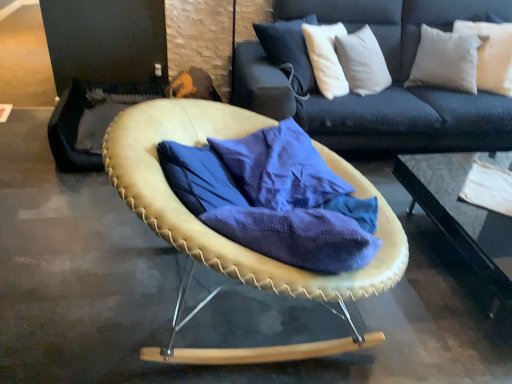
Question: Is white soft pillow at upper right completely or partially outside of leather-like tan chair at center?

Choices:
 (A) no
 (B) yes

Answer: (B)

Question: From the image's perspective, is white soft pillow at upper right located beneath leather-like tan chair at center?

Choices:
 (A) yes
 (B) no

Answer: (B)

Question: Are white soft pillow at upper right and leather-like tan chair at center far apart?

Choices:
 (A) yes
 (B) no

Answer: (A)

Question: Can you see white soft pillow at upper right touching leather-like tan chair at center?

Choices:
 (A) no
 (B) yes

Answer: (A)

Question: Is white soft pillow at upper right aimed at leather-like tan chair at center?

Choices:
 (A) no
 (B) yes

Answer: (A)

Question: Relative to white soft pillow at upper right, is leather-like tan chair at center in front or behind?

Choices:
 (A) behind
 (B) front

Answer: (B)

Question: Is leather-like tan chair at center wider or thinner than white soft pillow at upper right?

Choices:
 (A) wide
 (B) thin

Answer: (A)

Question: Looking at the image, does leather-like tan chair at center seem bigger or smaller compared to white soft pillow at upper right?

Choices:
 (A) small
 (B) big

Answer: (B)

Question: Considering the positions of point (353, 279) and point (505, 79), is point (353, 279) closer or farther from the camera than point (505, 79)?

Choices:
 (A) closer
 (B) farther

Answer: (A)

Question: Does point (437, 170) appear closer or farther from the camera than point (489, 26)?

Choices:
 (A) farther
 (B) closer

Answer: (A)

Question: Which is correct: transparent glass table at center is inside white soft pillow at upper right, or outside of it?

Choices:
 (A) outside
 (B) inside

Answer: (A)

Question: From a real-world perspective, is transparent glass table at center positioned above or below white soft pillow at upper right?

Choices:
 (A) below
 (B) above

Answer: (A)

Question: In terms of width, does transparent glass table at center look wider or thinner when compared to white soft pillow at upper right?

Choices:
 (A) thin
 (B) wide

Answer: (B)

Question: Considering their positions, is white soft pillow at upper right located in front of or behind transparent glass table at center?

Choices:
 (A) behind
 (B) front

Answer: (A)

Question: In terms of width, does white soft pillow at upper right look wider or thinner when compared to transparent glass table at center?

Choices:
 (A) thin
 (B) wide

Answer: (A)